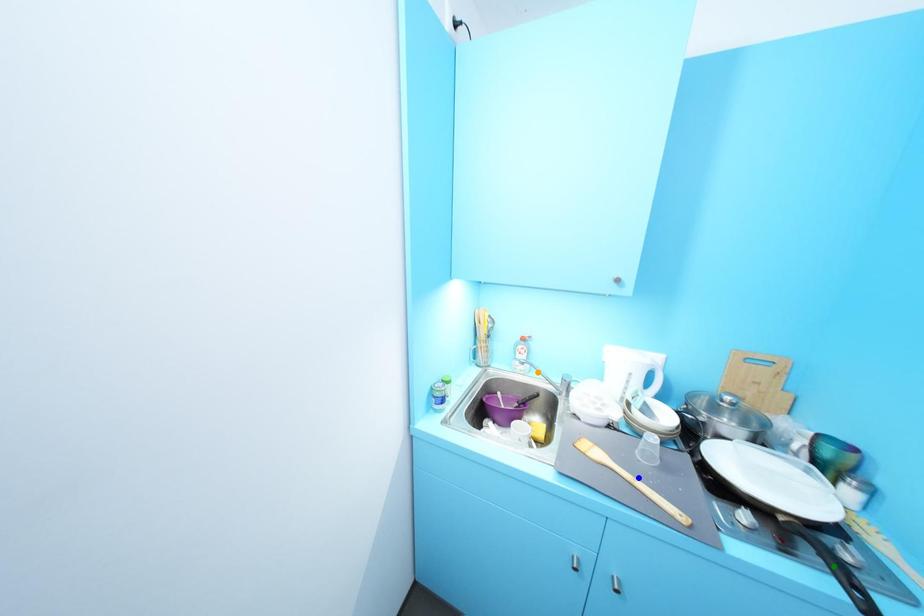
Order these from farthest to nearest:
green point
orange point
blue point

orange point, blue point, green point